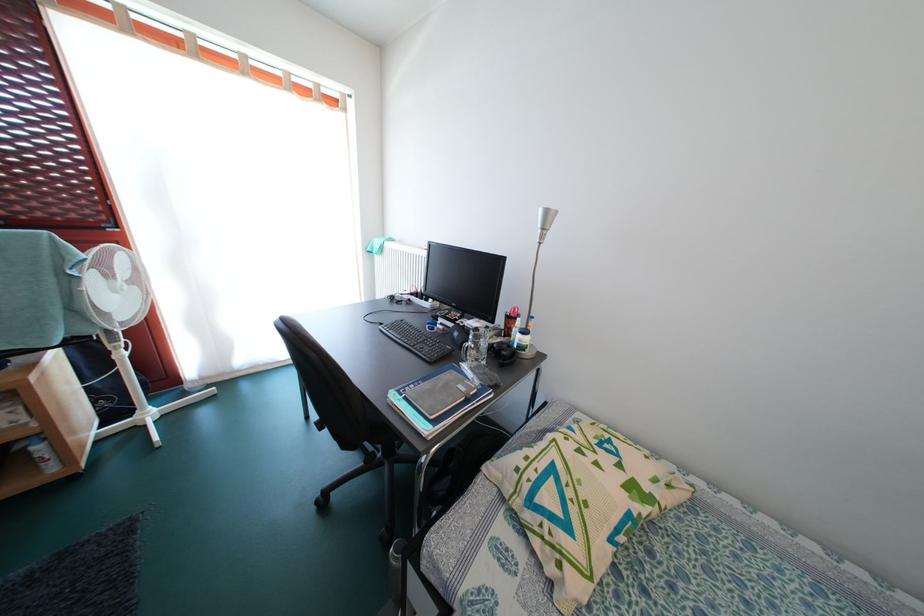
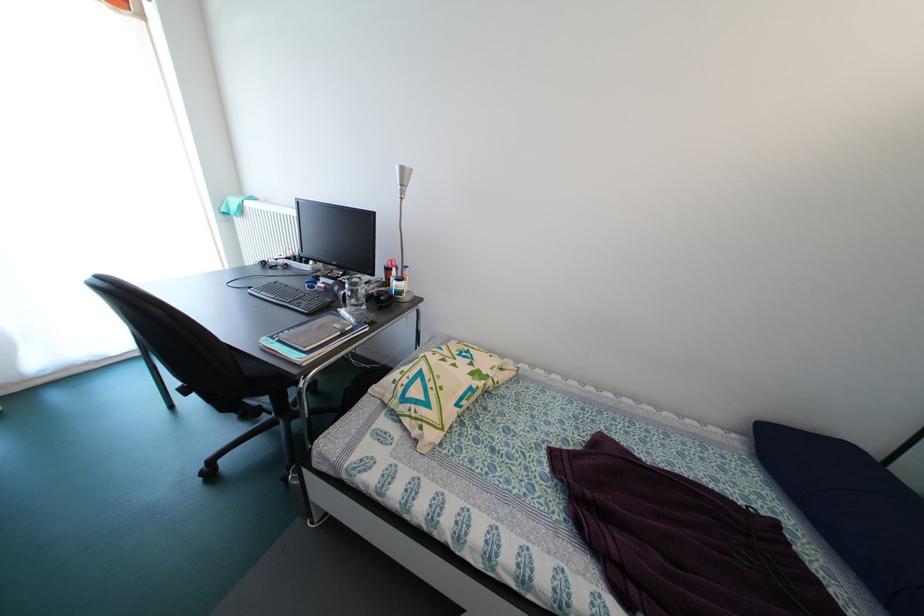
Where in the second image is the point corresponding to point (621, 445) from the first image?

(479, 355)